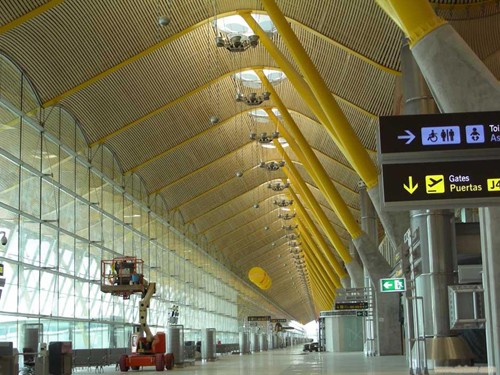
Locate an element on the screen. Image resolution: width=500 pixels, height=375 pixels. window is located at coordinates (54, 295).